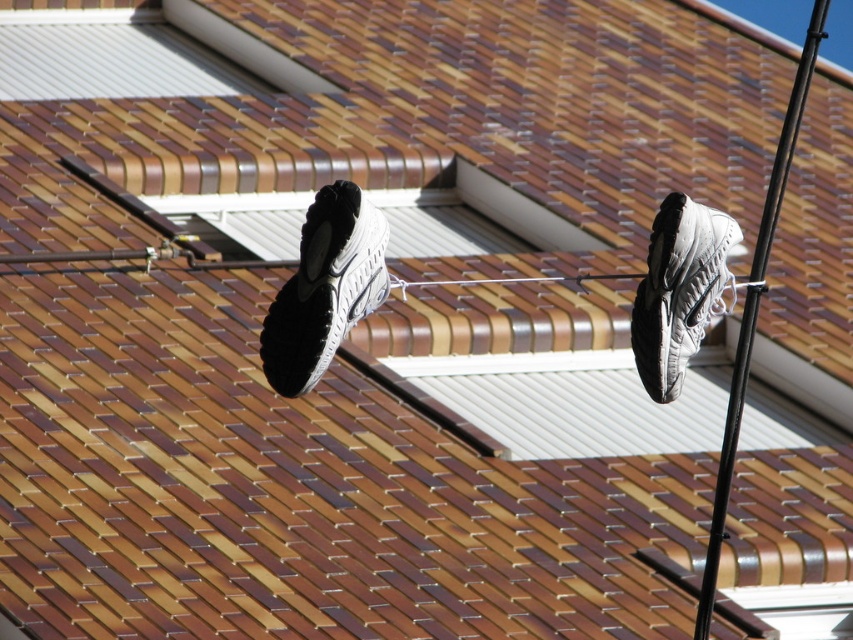
Question: Which point is farther to the camera?

Choices:
 (A) white matte shoe at center
 (B) gray fabric shoe at upper right

Answer: (B)

Question: Does white matte shoe at center appear on the left side of gray fabric shoe at upper right?

Choices:
 (A) yes
 (B) no

Answer: (A)

Question: Considering the relative positions of white matte shoe at center and gray fabric shoe at upper right in the image provided, where is white matte shoe at center located with respect to gray fabric shoe at upper right?

Choices:
 (A) left
 (B) right

Answer: (A)

Question: Which point is closer to the camera?

Choices:
 (A) (323, 244)
 (B) (648, 385)

Answer: (A)

Question: Among these objects, which one is farthest from the camera?

Choices:
 (A) white matte shoe at center
 (B) gray fabric shoe at upper right

Answer: (B)

Question: Is white matte shoe at center wider than gray fabric shoe at upper right?

Choices:
 (A) no
 (B) yes

Answer: (B)